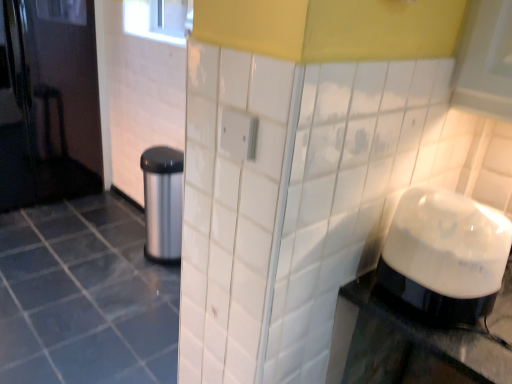
Question: Is satin silver trash can at left turned away from white glossy blender at right?

Choices:
 (A) no
 (B) yes

Answer: (A)

Question: From a real-world perspective, is satin silver trash can at left below white glossy blender at right?

Choices:
 (A) no
 (B) yes

Answer: (B)

Question: Is satin silver trash can at left further to camera compared to white glossy blender at right?

Choices:
 (A) yes
 (B) no

Answer: (A)

Question: Does satin silver trash can at left have a lesser width compared to white glossy blender at right?

Choices:
 (A) yes
 (B) no

Answer: (B)

Question: Does satin silver trash can at left have a lesser height compared to white glossy blender at right?

Choices:
 (A) yes
 (B) no

Answer: (B)

Question: Is point (135, 261) positioned closer to the camera than point (177, 205)?

Choices:
 (A) farther
 (B) closer

Answer: (A)

Question: In terms of width, does white glossy tile at center look wider or thinner when compared to satin silver trash can at left?

Choices:
 (A) thin
 (B) wide

Answer: (B)

Question: Based on their positions, is white glossy tile at center located to the left or right of satin silver trash can at left?

Choices:
 (A) right
 (B) left

Answer: (B)

Question: From their relative heights in the image, would you say white glossy tile at center is taller or shorter than satin silver trash can at left?

Choices:
 (A) tall
 (B) short

Answer: (B)

Question: Looking at their shapes, would you say white glossy blender at right is wider or thinner than satin silver trash can at left?

Choices:
 (A) thin
 (B) wide

Answer: (A)

Question: Considering the positions of point (487, 278) and point (148, 200), is point (487, 278) closer or farther from the camera than point (148, 200)?

Choices:
 (A) farther
 (B) closer

Answer: (B)

Question: From the image's perspective, is white glossy blender at right located above or below satin silver trash can at left?

Choices:
 (A) above
 (B) below

Answer: (B)

Question: Considering their positions, is white glossy blender at right located in front of or behind satin silver trash can at left?

Choices:
 (A) front
 (B) behind

Answer: (A)

Question: Is white glossy blender at right taller or shorter than white glossy tile at center?

Choices:
 (A) short
 (B) tall

Answer: (B)

Question: From a real-world perspective, is white glossy blender at right physically located above or below white glossy tile at center?

Choices:
 (A) above
 (B) below

Answer: (A)